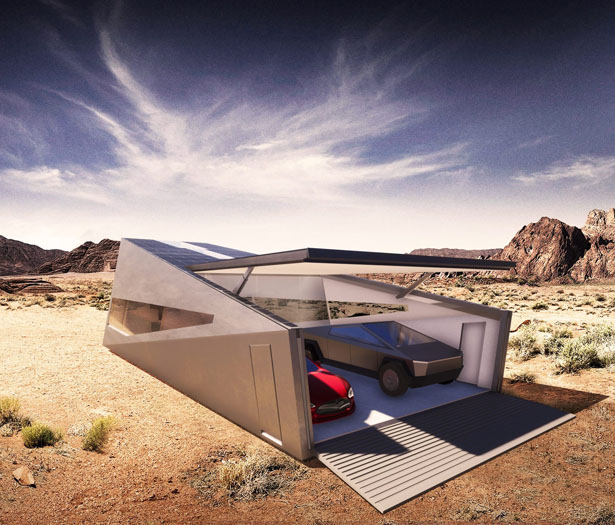
You are a GUI agent. You are given a task and a screenshot of the screen. Output one action in this format:
    pyautogui.click(x=<x>, y=<y>)
    Task: Click on the floor
    The image size is (615, 525).
    Given the screenshot: What is the action you would take?
    pyautogui.click(x=384, y=401)